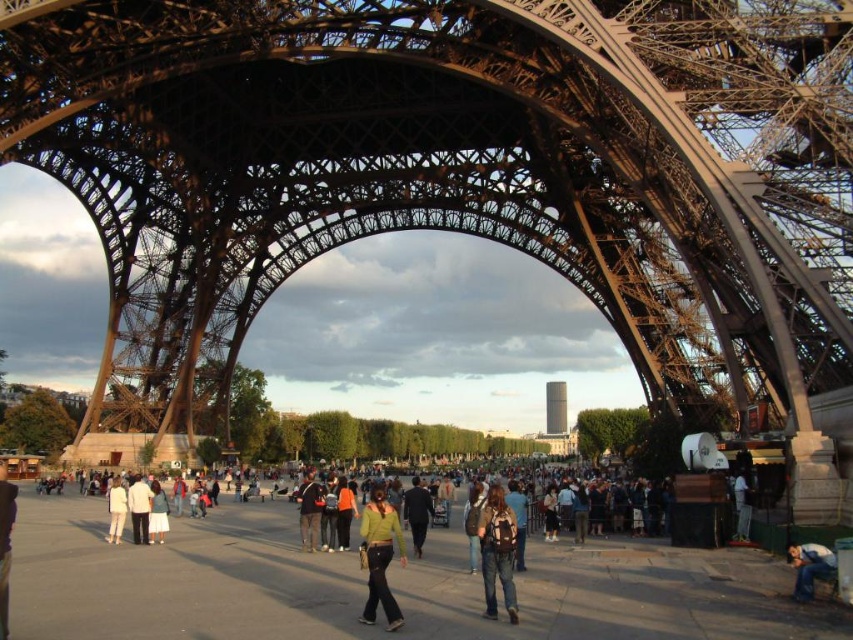
Question: Which is nearer to the dark brown backpack at center?

Choices:
 (A) green knit sweater at center
 (B) smooth glass tower at center
 (C) white cotton shirt at lower left
 (D) light beige pants at center

Answer: (A)

Question: Does white fabric shirt at lower right lie in front of white cotton shirt at lower left?

Choices:
 (A) yes
 (B) no

Answer: (A)

Question: Which is nearer to the black matte suit at center?

Choices:
 (A) white fabric shirt at lower right
 (B) light beige pants at center

Answer: (B)

Question: Is black matte suit at center further to camera compared to smooth glass tower at center?

Choices:
 (A) yes
 (B) no

Answer: (B)

Question: Is dark brown backpack at center to the left of dark gray backpack at center from the viewer's perspective?

Choices:
 (A) no
 (B) yes

Answer: (A)

Question: Which point appears farthest from the camera in this image?

Choices:
 (A) (795, 582)
 (B) (740, 540)
 (C) (122, 499)

Answer: (C)